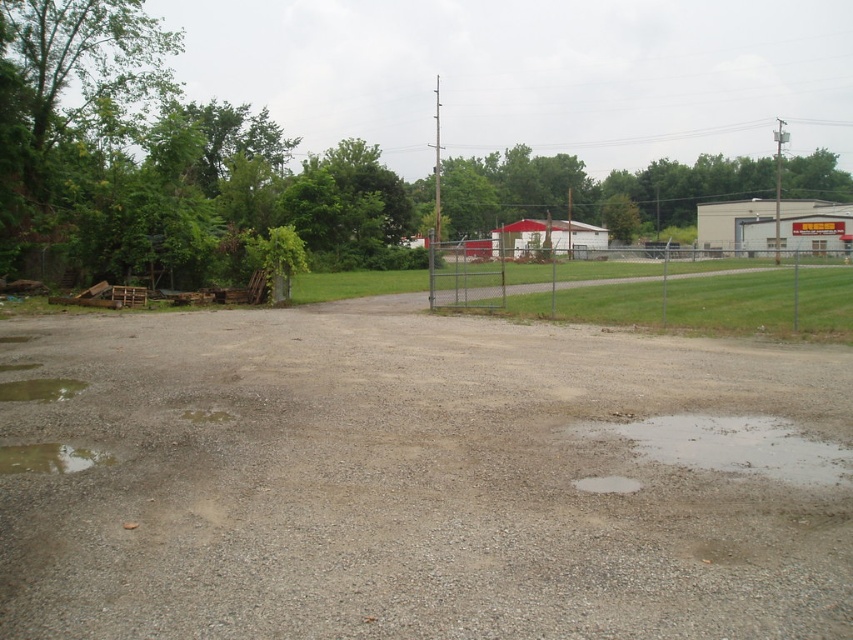
From the picture: You are navigating a small drone over the open gravel area and need to avoid the transparent wet gravel at lower left. What coordinates should you steer clear of to avoid this area?

The transparent wet gravel at lower left is located at point (48, 458), so you should avoid steering the drone near those coordinates.

You are standing at the edge of the gravel area looking towards the chain link fence. There are two points marked on the ground. One is at coordinate point (728, 461) and the other at point (70, 381). Which point is closer to you?

Point (728, 461) is closer to the viewer than point (70, 381).

You are a delivery robot with a width of 0.8 meters. You need to navigate through the gravel area to reach the grassy field behind the fence. There are two puddles of water in your path. The first is the transparent water at lower left, and the second is the clear water at lower right. Which puddle should you avoid to ensure you can pass through without getting stuck?

The transparent water at lower left is narrower than the clear water at lower right. Since the robot is 0.8 meters wide, it should avoid the transparent water at lower left and choose the wider clear water at lower right to pass through safely.